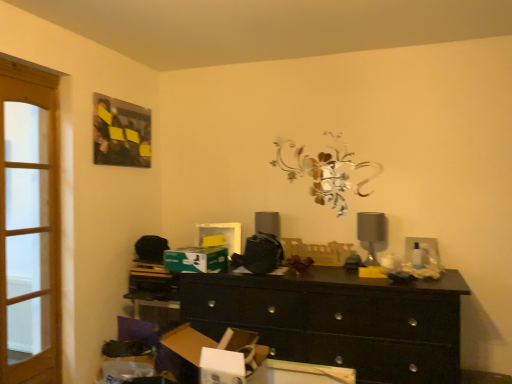
Describe the element at coordinates (182, 352) in the screenshot. I see `cardboard box at lower left, arranged as the first cardboard box when viewed from the front` at that location.

How much space does cardboard box at lower left, positioned as the 2th cardboard box in top-to-bottom order, occupy horizontally?

The width of cardboard box at lower left, positioned as the 2th cardboard box in top-to-bottom order, is 14.59 inches.

What do you see at coordinates (371, 232) in the screenshot? This screenshot has height=384, width=512. I see `matte black table lamp at right` at bounding box center [371, 232].

Locate an element on the screen. This screenshot has height=384, width=512. green cardboard box at center, which appears as the second cardboard box when viewed from the front is located at coordinates (196, 259).

You are a GUI agent. You are given a task and a screenshot of the screen. Output one action in this format:
    pyautogui.click(x=<x>, y=<y>)
    Task: Click on the cardboard box at lower left, positioned as the 2th cardboard box in top-to-bottom order
    This screenshot has width=512, height=384.
    Given the screenshot: What is the action you would take?
    pyautogui.click(x=182, y=352)

Is green cardboard box at center, marked as the 2th cardboard box in a bottom-to-top arrangement, turned away from yellow plastic tray at center?

No, green cardboard box at center, marked as the 2th cardboard box in a bottom-to-top arrangement,'s orientation is not away from yellow plastic tray at center.

Could you measure the distance between green cardboard box at center, which appears as the second cardboard box when viewed from the front, and yellow plastic tray at center?

green cardboard box at center, which appears as the second cardboard box when viewed from the front, and yellow plastic tray at center are 56.72 centimeters apart from each other.

In the scene shown: From a real-world perspective, is green cardboard box at center, the 1th cardboard box positioned from the top, below yellow plastic tray at center?

Indeed, from a real-world perspective, green cardboard box at center, the 1th cardboard box positioned from the top, is positioned beneath yellow plastic tray at center.

Can you see green cardboard box at center, arranged as the 1th cardboard box when viewed from the back, touching yellow plastic tray at center?

green cardboard box at center, arranged as the 1th cardboard box when viewed from the back, is not next to yellow plastic tray at center, and they're not touching.

In the scene shown: Does light brown wooden screen door at left appear on the right side of yellow plastic tray at center?

No.

Is light brown wooden screen door at left in contact with yellow plastic tray at center?

No, light brown wooden screen door at left is not in contact with yellow plastic tray at center.

Considering the points (57, 200) and (294, 243), which point is behind, point (57, 200) or point (294, 243)?

The point (294, 243) is more distant.

From a real-world perspective, is yellow plastic tray at center below cardboard box at lower left, the first cardboard box in the bottom-to-top sequence?

Actually, yellow plastic tray at center is physically above cardboard box at lower left, the first cardboard box in the bottom-to-top sequence, in the real world.

From the image's perspective, does yellow plastic tray at center appear higher than cardboard box at lower left, the first cardboard box in the bottom-to-top sequence?

Yes, from the image's perspective, yellow plastic tray at center is on top of cardboard box at lower left, the first cardboard box in the bottom-to-top sequence.

Would you say cardboard box at lower left, the first cardboard box in the bottom-to-top sequence, is part of yellow plastic tray at center's contents?

No, cardboard box at lower left, the first cardboard box in the bottom-to-top sequence, is not surrounded by yellow plastic tray at center.

Which is nearer, (328,249) or (40,86)?

Positioned in front is point (40,86).

Would you say yellow plastic tray at center is inside or outside light brown wooden screen door at left?

yellow plastic tray at center is not enclosed by light brown wooden screen door at left.

Does yellow plastic tray at center have a lesser width compared to light brown wooden screen door at left?

Correct, the width of yellow plastic tray at center is less than that of light brown wooden screen door at left.

Between yellow plastic tray at center and light brown wooden screen door at left, which one has larger size?

light brown wooden screen door at left.

Based on the photo, does cardboard box at lower left, arranged as the first cardboard box when viewed from the front, have a smaller size compared to yellow plastic tray at center?

No, cardboard box at lower left, arranged as the first cardboard box when viewed from the front, is not smaller than yellow plastic tray at center.

Which of these two, cardboard box at lower left, marked as the 2th cardboard box in a back-to-front arrangement, or yellow plastic tray at center, is wider?

Wider between the two is cardboard box at lower left, marked as the 2th cardboard box in a back-to-front arrangement.

Is cardboard box at lower left, the first cardboard box in the bottom-to-top sequence, located outside yellow plastic tray at center?

cardboard box at lower left, the first cardboard box in the bottom-to-top sequence, is positioned outside yellow plastic tray at center.

Between cardboard box at lower left, marked as the 2th cardboard box in a back-to-front arrangement, and yellow plastic tray at center, which one has less height?

yellow plastic tray at center.

Is yellow plastic tray at center to the right of matte black table lamp at right from the viewer's perspective?

In fact, yellow plastic tray at center is to the left of matte black table lamp at right.

Would you say yellow plastic tray at center is a long distance from matte black table lamp at right?

No, yellow plastic tray at center is in close proximity to matte black table lamp at right.

Would you say yellow plastic tray at center contains matte black table lamp at right?

No, yellow plastic tray at center does not contain matte black table lamp at right.

The width and height of the screenshot is (512, 384). I want to click on swivel chair on the left of matte black table lamp at right, so click(x=318, y=251).

From the picture: Measure the distance from matte black table lamp at right to black wood chest of drawers at center.

matte black table lamp at right and black wood chest of drawers at center are 25.12 inches apart from each other.

Is matte black table lamp at right inside the boundaries of black wood chest of drawers at center, or outside?

matte black table lamp at right is spatially situated outside black wood chest of drawers at center.

From their relative heights in the image, would you say matte black table lamp at right is taller or shorter than black wood chest of drawers at center?

In the image, matte black table lamp at right appears to be shorter than black wood chest of drawers at center.

The height and width of the screenshot is (384, 512). I want to click on cardboard box that is the 2nd object to the left of the yellow plastic tray at center, starting at the anchor, so click(x=196, y=259).

What are the coordinates of `swivel chair behind the light brown wooden screen door at left` in the screenshot? It's located at (318, 251).

Considering their positions, is light brown wooden screen door at left positioned closer to green cardboard box at center, arranged as the 1th cardboard box when viewed from the back, than yellow plastic tray at center?

yellow plastic tray at center.

Looking at the image, which one is located closer to yellow plastic tray at center, light brown wooden screen door at left or cardboard box at lower left, the first cardboard box in the bottom-to-top sequence?

Among the two, cardboard box at lower left, the first cardboard box in the bottom-to-top sequence, is located nearer to yellow plastic tray at center.

Based on their spatial positions, is matte black table lamp at right or black wood chest of drawers at center further from green cardboard box at center, arranged as the 1th cardboard box when viewed from the back?

matte black table lamp at right lies further to green cardboard box at center, arranged as the 1th cardboard box when viewed from the back, than the other object.

From the picture: Considering their positions, is yellow plastic tray at center positioned closer to cardboard box at lower left, positioned as the 2th cardboard box in top-to-bottom order, than light brown wooden screen door at left?

light brown wooden screen door at left lies closer to cardboard box at lower left, positioned as the 2th cardboard box in top-to-bottom order, than the other object.

Considering their positions, is cardboard box at lower left, arranged as the first cardboard box when viewed from the front, positioned closer to light brown wooden screen door at left than black wood chest of drawers at center?

The object closer to light brown wooden screen door at left is cardboard box at lower left, arranged as the first cardboard box when viewed from the front.

Considering their positions, is matte black table lamp at right positioned further to green cardboard box at center, marked as the 2th cardboard box in a bottom-to-top arrangement, than cardboard box at lower left, marked as the 2th cardboard box in a back-to-front arrangement?

Based on the image, matte black table lamp at right appears to be further to green cardboard box at center, marked as the 2th cardboard box in a bottom-to-top arrangement.

Estimate the real-world distances between objects in this image. Which object is closer to black wood chest of drawers at center, light brown wooden screen door at left or cardboard box at lower left, marked as the 2th cardboard box in a back-to-front arrangement?

cardboard box at lower left, marked as the 2th cardboard box in a back-to-front arrangement, is positioned closer to the anchor black wood chest of drawers at center.

When comparing their distances from matte black table lamp at right, does cardboard box at lower left, arranged as the first cardboard box when viewed from the front, or yellow plastic tray at center seem further?

cardboard box at lower left, arranged as the first cardboard box when viewed from the front, lies further to matte black table lamp at right than the other object.

Locate an element on the screen. the chest of drawers situated between green cardboard box at center, which appears as the second cardboard box when viewed from the front, and yellow plastic tray at center from left to right is located at coordinates pos(338,320).

Locate an element on the screen. cardboard box situated between green cardboard box at center, which appears as the second cardboard box when viewed from the front, and black wood chest of drawers at center from left to right is located at coordinates (182, 352).

At what (x,y) coordinates should I click in order to perform the action: click on chest of drawers between light brown wooden screen door at left and yellow plastic tray at center in the horizontal direction. Please return your answer as a coordinate pair (x, y). Looking at the image, I should click on (338, 320).

Identify the location of the chest of drawers situated between cardboard box at lower left, the first cardboard box in the bottom-to-top sequence, and matte black table lamp at right from left to right. (338, 320).